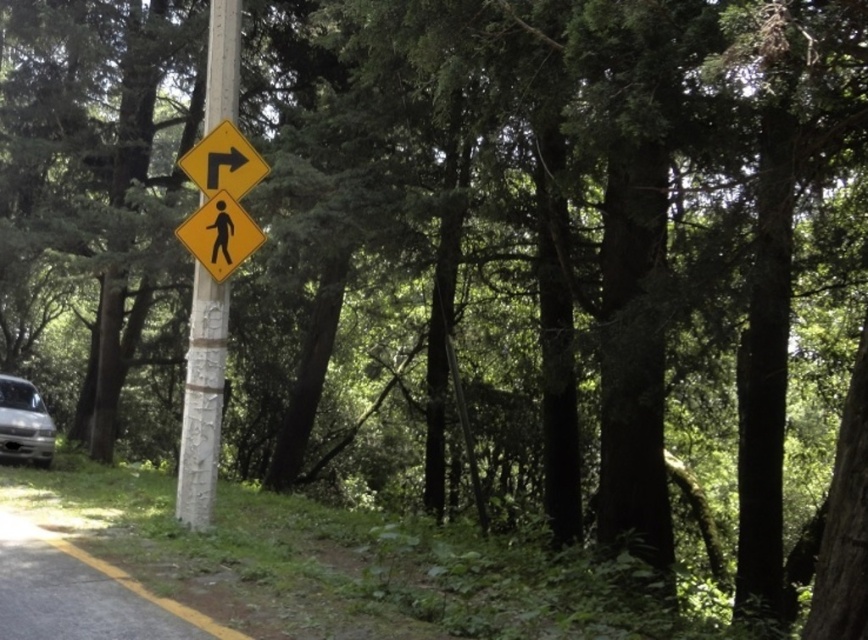
Question: Considering the relative positions of white painted wood pole at center and silver metallic van at lower left in the image provided, where is white painted wood pole at center located with respect to silver metallic van at lower left?

Choices:
 (A) right
 (B) left

Answer: (A)

Question: Which point is farther to the camera?

Choices:
 (A) (209, 369)
 (B) (227, 240)
 (C) (235, 132)

Answer: (A)

Question: Is white painted wood pole at center closer to camera compared to silver metallic van at lower left?

Choices:
 (A) yes
 (B) no

Answer: (A)

Question: Which of the following is the farthest from the observer?

Choices:
 (A) (25, 413)
 (B) (183, 236)
 (C) (228, 145)

Answer: (A)

Question: Does yellow matte pedestrian crossing sign at upper center lie in front of silver metallic van at lower left?

Choices:
 (A) no
 (B) yes

Answer: (B)

Question: Which object appears farthest from the camera in this image?

Choices:
 (A) silver metallic van at lower left
 (B) yellow matte pedestrian crossing sign at upper center

Answer: (A)